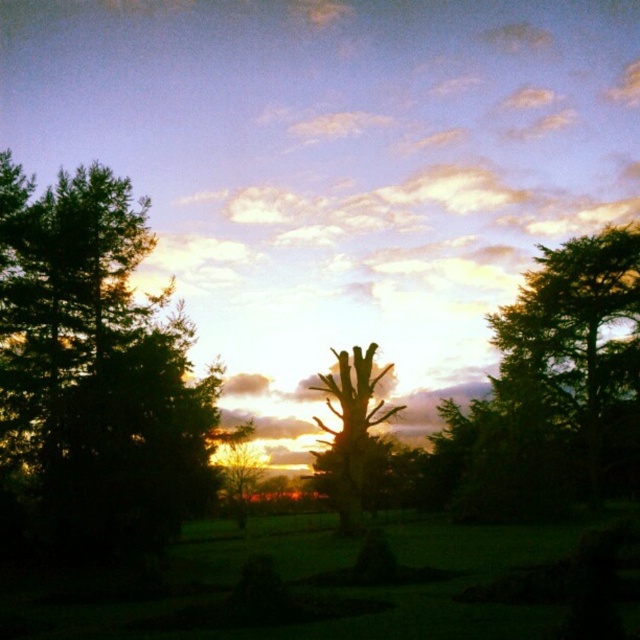
Question: Can you confirm if dark green leafy tree at left is positioned below silhouette wood tree at center?

Choices:
 (A) yes
 (B) no

Answer: (B)

Question: Can you confirm if dark green leafy tree at left is thinner than silhouette wood tree at center?

Choices:
 (A) yes
 (B) no

Answer: (B)

Question: Which point is closer to the camera?

Choices:
 (A) white fluffy cloud at upper center
 (B) dark green leafy tree at left

Answer: (B)

Question: Among these points, which one is nearest to the camera?

Choices:
 (A) (332, 300)
 (B) (344, 380)
 (C) (113, 314)
 (D) (240, 442)

Answer: (C)

Question: Which point is closer to the camera?

Choices:
 (A) silhouette wood tree at center
 (B) white fluffy cloud at upper center
 (C) green leafy tree at center

Answer: (C)

Question: Is dark green leafy tree at left below silhouette wood tree at center?

Choices:
 (A) yes
 (B) no

Answer: (B)